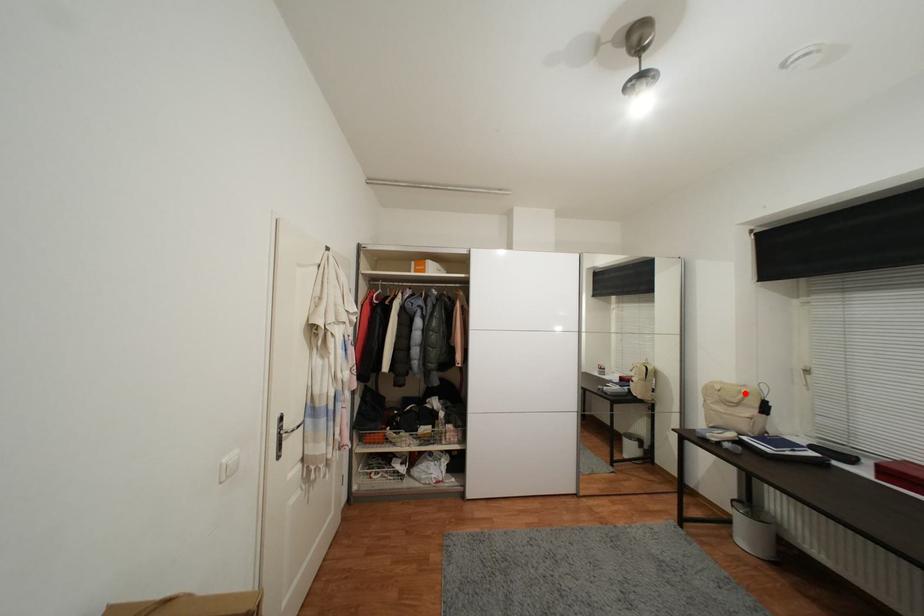
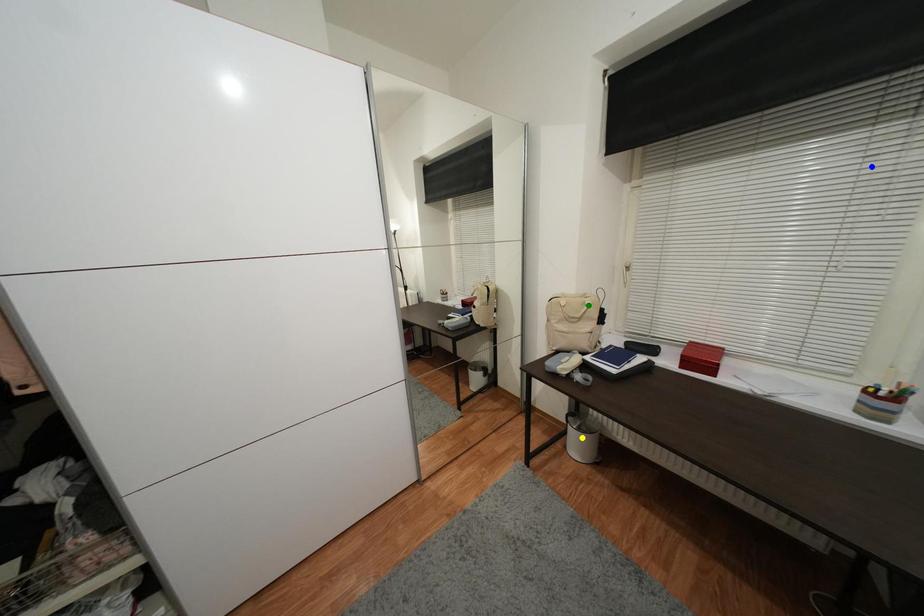
Question: I am providing you with two images of the same scene from different viewpoints. A red point is marked on the first image. You are given multiple points on the second image. Which spot in image 2 lines up with the point in image 1?

Choices:
 (A) green point
 (B) blue point
 (C) yellow point

Answer: (A)